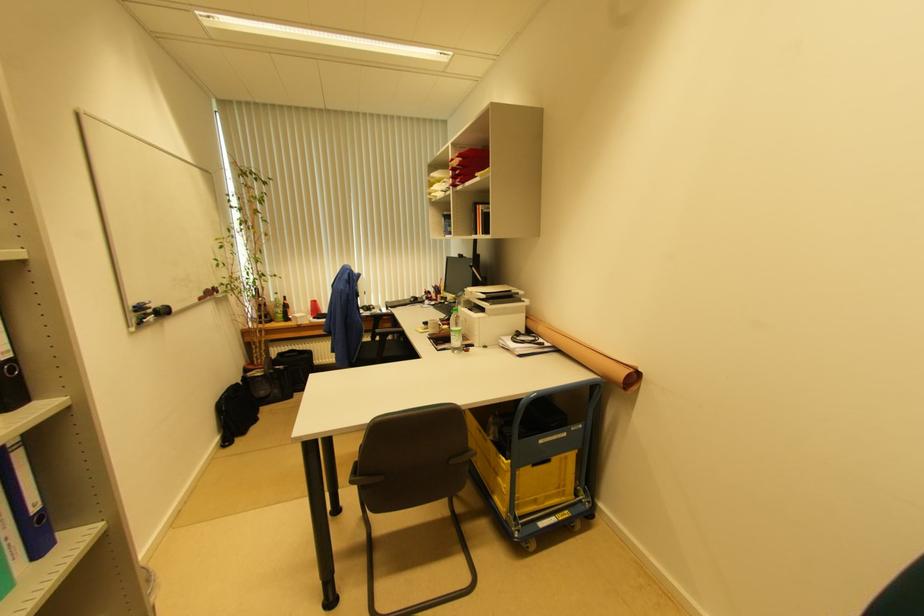
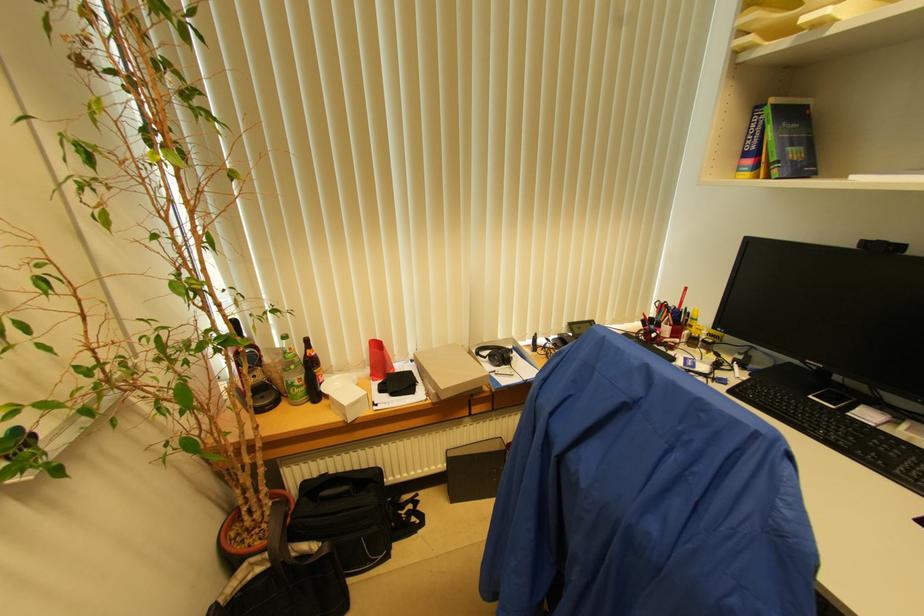
Locate, in the second image, the point that corresponds to (462,259) in the first image.

(882, 251)